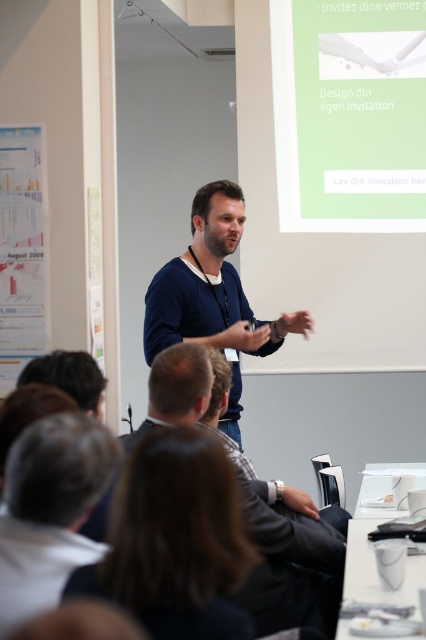
Question: Is the position of green matte projection screen at upper center more distant than that of dark blue sweater at center?

Choices:
 (A) yes
 (B) no

Answer: (A)

Question: Which point is farther to the camera?

Choices:
 (A) dark brown hair at upper center
 (B) green matte projection screen at upper center
 (C) white fabric shirt at lower left
 (D) dark blue sweater at center

Answer: (B)

Question: Is dark brown hair at upper center to the right of white fabric shirt at lower left from the viewer's perspective?

Choices:
 (A) yes
 (B) no

Answer: (A)

Question: Estimate the real-world distances between objects in this image. Which object is closer to the dark blue sweater at center?

Choices:
 (A) green matte projection screen at upper center
 (B) white fabric shirt at lower left

Answer: (A)

Question: Which of the following is the closest to the observer?

Choices:
 (A) dark brown hair at upper center
 (B) dark blue sweater at center
 (C) white fabric shirt at lower left
 (D) green matte projection screen at upper center

Answer: (C)

Question: Is green matte projection screen at upper center wider than dark brown hair at upper center?

Choices:
 (A) yes
 (B) no

Answer: (A)